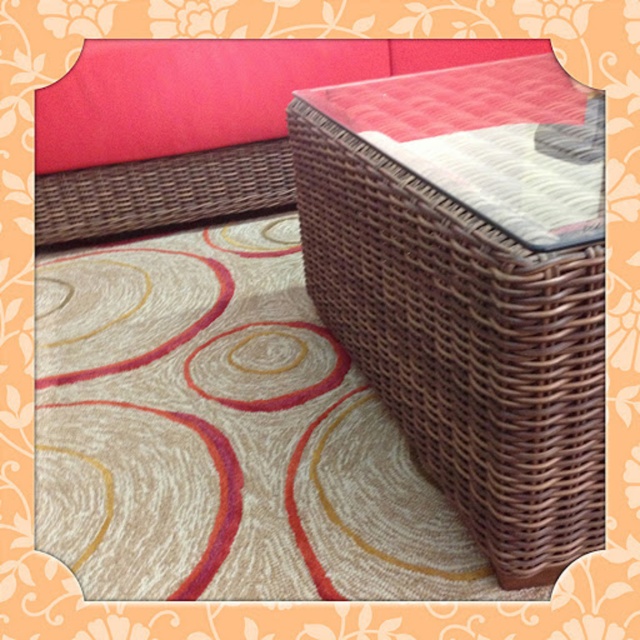
Question: Which point is closer to the camera taking this photo?

Choices:
 (A) (314, 67)
 (B) (432, 202)

Answer: (B)

Question: Can you confirm if brown woven basket at center is thinner than brown wicker couch at upper center?

Choices:
 (A) yes
 (B) no

Answer: (A)

Question: Which point is closer to the camera?

Choices:
 (A) brown wicker couch at upper center
 (B) brown woven basket at center

Answer: (B)

Question: Observing the image, what is the correct spatial positioning of brown woven basket at center in reference to brown wicker couch at upper center?

Choices:
 (A) below
 (B) above

Answer: (A)

Question: Is brown woven basket at center bigger than brown wicker couch at upper center?

Choices:
 (A) no
 (B) yes

Answer: (B)